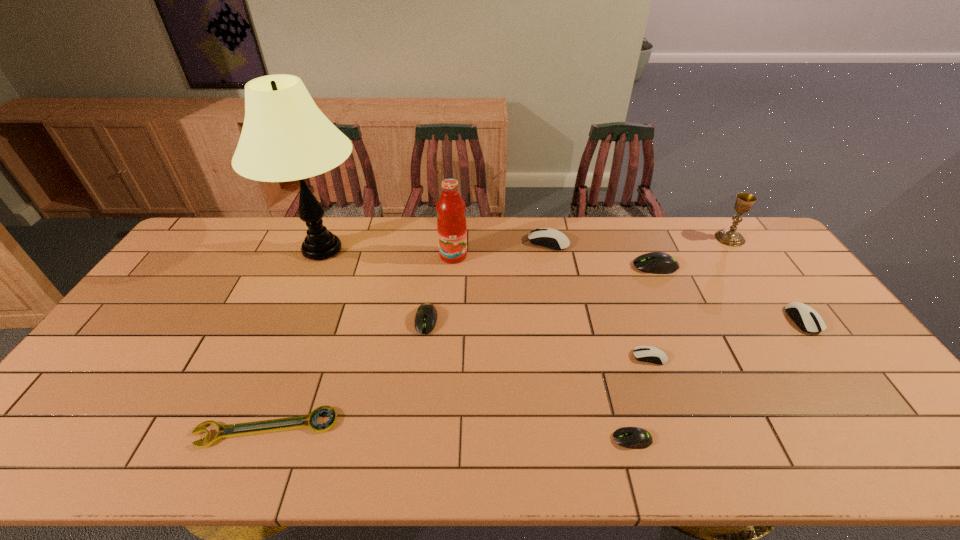
This screenshot has height=540, width=960. In order to click on black lamp in this screenshot , I will do `click(285, 137)`.

Locate an element on the screen. This screenshot has height=540, width=960. the tallest object is located at coordinates (285, 137).

Find the location of a particular element. Image resolution: width=960 pixels, height=540 pixels. the ninth shortest object is located at coordinates (x=451, y=223).

The height and width of the screenshot is (540, 960). I want to click on the eighth shortest object, so click(x=744, y=201).

Find the location of a particular element. This screenshot has width=960, height=540. chalice is located at coordinates (744, 201).

This screenshot has width=960, height=540. I want to click on the farthest white mouse, so click(550, 238).

Where is `the leftmost white mouse`? This screenshot has width=960, height=540. the leftmost white mouse is located at coordinates (550, 238).

Locate an element on the screen. This screenshot has height=540, width=960. the rightmost gray computer mouse is located at coordinates (655, 262).

Where is `the fifth computer mouse from left to right`? The image size is (960, 540). the fifth computer mouse from left to right is located at coordinates (655, 262).

You are a GUI agent. You are given a task and a screenshot of the screen. Output one action in this format:
    pyautogui.click(x=<x>, y=<y>)
    Task: Click on the second smallest white mouse
    Image resolution: width=960 pixels, height=540 pixels.
    Given the screenshot: What is the action you would take?
    pyautogui.click(x=806, y=318)